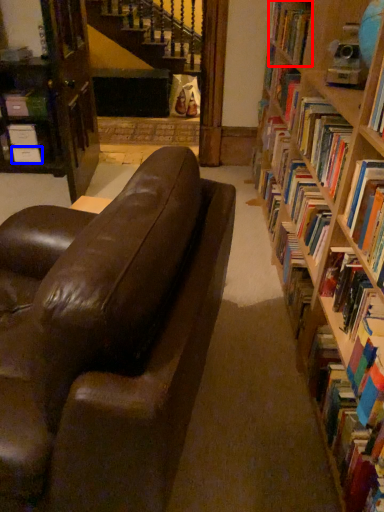
Question: Which object appears closest to the camera in this image, book (highlighted by a red box) or paperback book (highlighted by a blue box)?

Choices:
 (A) book
 (B) paperback book

Answer: (A)